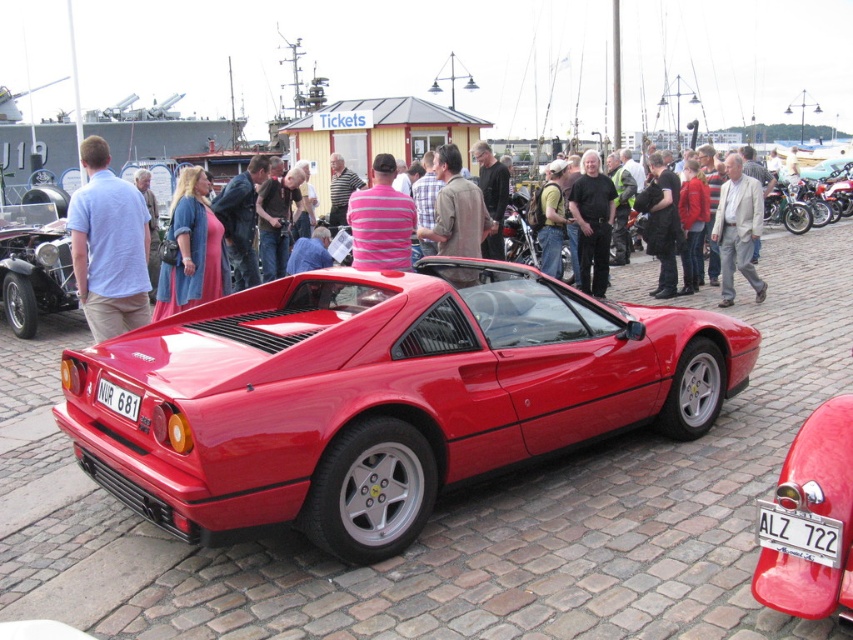
Is shiny red sports car at center smaller than matte blue shirt at center?

No.

Image resolution: width=853 pixels, height=640 pixels. What do you see at coordinates (380, 396) in the screenshot?
I see `shiny red sports car at center` at bounding box center [380, 396].

Where is `shiny red sports car at center`? shiny red sports car at center is located at coordinates (380, 396).

Is shiny chrome vintage car at left wider than yellow-green fabric backpack at center?

Correct, the width of shiny chrome vintage car at left exceeds that of yellow-green fabric backpack at center.

This screenshot has height=640, width=853. Describe the element at coordinates (33, 275) in the screenshot. I see `shiny chrome vintage car at left` at that location.

This screenshot has width=853, height=640. What are the coordinates of `shiny chrome vintage car at left` in the screenshot? It's located at (33, 275).

What do you see at coordinates (660, 221) in the screenshot? I see `black leather jacket at center` at bounding box center [660, 221].

Does black leather jacket at center appear on the right side of yellow-green fabric backpack at center?

Correct, you'll find black leather jacket at center to the right of yellow-green fabric backpack at center.

Does point (666, 236) come in front of point (546, 170)?

Yes, point (666, 236) is in front of point (546, 170).

Identify the location of black leather jacket at center. The width and height of the screenshot is (853, 640). (660, 221).